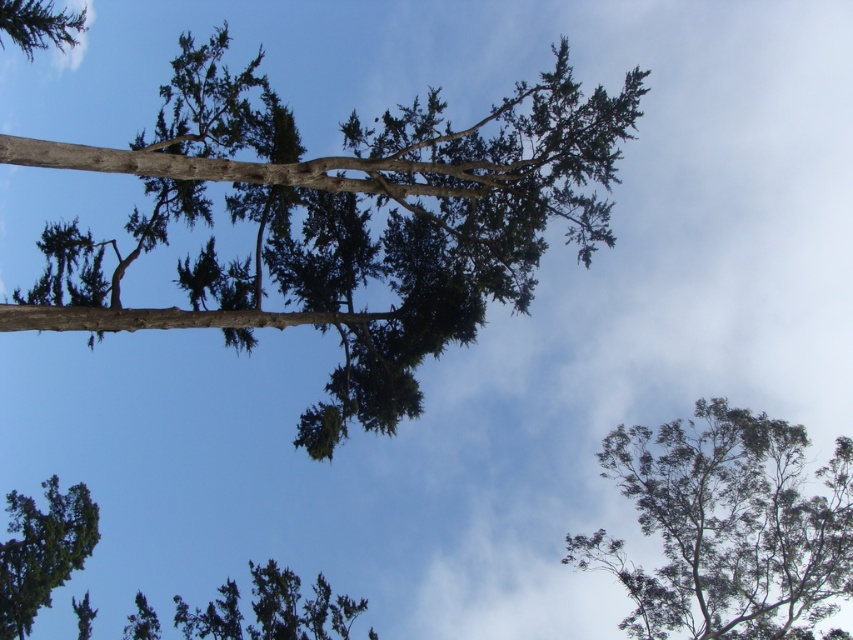
Is green leafy tree at upper right taller than green textured tree at lower center?

Yes, green leafy tree at upper right is taller than green textured tree at lower center.

Is green leafy tree at upper right thinner than green textured tree at lower center?

No, green leafy tree at upper right is not thinner than green textured tree at lower center.

Identify the location of green leafy tree at upper right. (727, 525).

Can you confirm if green textured tree at center is positioned above green needle-like at upper left?

Incorrect, green textured tree at center is not positioned above green needle-like at upper left.

Is green textured tree at center bigger than green needle-like at upper left?

Yes, green textured tree at center is bigger than green needle-like at upper left.

Which is behind, point (274, 163) or point (50, 26)?

The point (50, 26) is more distant.

In order to click on green textured tree at center in this screenshot , I will do `click(340, 221)`.

The height and width of the screenshot is (640, 853). I want to click on green textured tree at center, so click(x=340, y=221).

Describe the element at coordinates (340, 221) in the screenshot. The image size is (853, 640). I see `green textured tree at center` at that location.

Where is `green textured tree at center`? The image size is (853, 640). green textured tree at center is located at coordinates (340, 221).